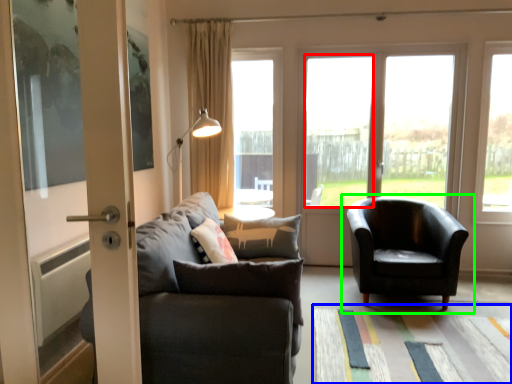
Question: Which is nearer to the window (highlighted by a red box)? mat (highlighted by a blue box) or chair (highlighted by a green box).

Choices:
 (A) mat
 (B) chair

Answer: (B)